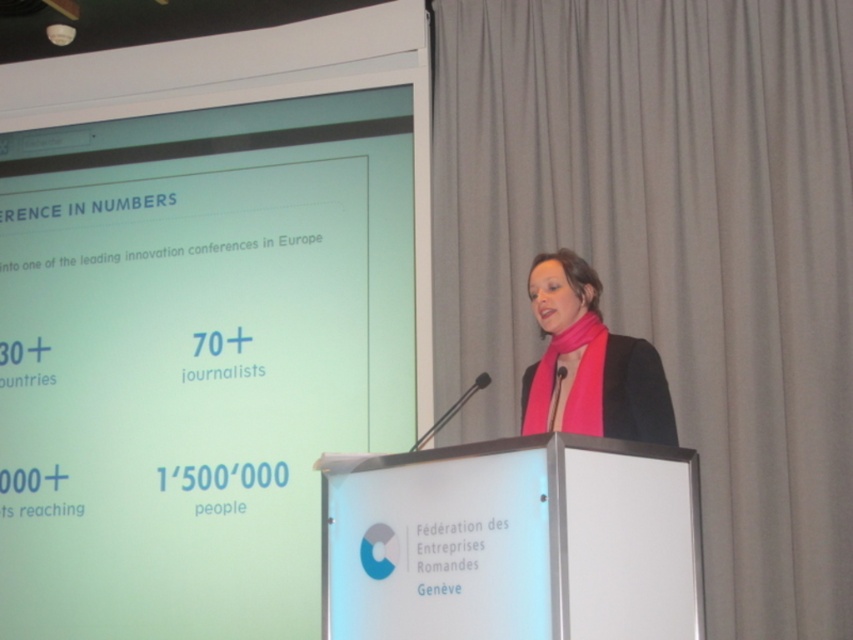
Is white glossy projection screen at upper left wider than matte gray curtain at upper right?

Yes, white glossy projection screen at upper left is wider than matte gray curtain at upper right.

Who is lower down, white glossy projection screen at upper left or matte gray curtain at upper right?

white glossy projection screen at upper left is lower down.

Does point (335, 168) lie behind point (473, 420)?

Yes, point (335, 168) is behind point (473, 420).

Where is `white glossy projection screen at upper left`? This screenshot has width=853, height=640. white glossy projection screen at upper left is located at coordinates (195, 356).

Can you confirm if matte gray curtain at upper right is positioned above pink fabric scarf at center?

Yes, matte gray curtain at upper right is above pink fabric scarf at center.

Is matte gray curtain at upper right positioned before pink fabric scarf at center?

No, matte gray curtain at upper right is behind pink fabric scarf at center.

Is point (724, 344) closer to camera compared to point (527, 291)?

No, (724, 344) is further to viewer.

Identify the location of matte gray curtain at upper right. (670, 252).

The width and height of the screenshot is (853, 640). What do you see at coordinates (195, 356) in the screenshot?
I see `white glossy projection screen at upper left` at bounding box center [195, 356].

Between point (268, 636) and point (653, 378), which one is positioned in front?

Point (653, 378)

Between point (1, 406) and point (674, 429), which one is positioned in front?

Point (674, 429) is more forward.

At what (x,y) coordinates should I click in order to perform the action: click on white glossy projection screen at upper left. Please return your answer as a coordinate pair (x, y). Image resolution: width=853 pixels, height=640 pixels. Looking at the image, I should click on (195, 356).